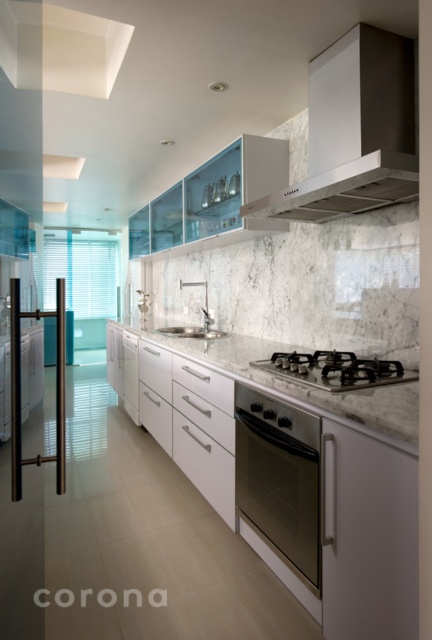
Question: Is white marble countertop at center thinner than satin nickel sink at center?

Choices:
 (A) no
 (B) yes

Answer: (A)

Question: Which point is closer to the camera?

Choices:
 (A) matte white exhaust hood at upper center
 (B) white glossy dishwasher at center

Answer: (A)

Question: Can you confirm if white glossy dishwasher at center is thinner than satin nickel sink at center?

Choices:
 (A) no
 (B) yes

Answer: (B)

Question: Which point appears closest to the camera in this image?

Choices:
 (A) pyautogui.click(x=210, y=336)
 (B) pyautogui.click(x=12, y=396)
 (C) pyautogui.click(x=130, y=388)
 (D) pyautogui.click(x=197, y=340)

Answer: (B)

Question: Which point appears closest to the camera in this image?

Choices:
 (A) (378, 384)
 (B) (245, 344)
 (C) (387, 36)

Answer: (A)

Question: Does stainless steel oven at center have a greater width compared to polished brass handle at center?

Choices:
 (A) no
 (B) yes

Answer: (A)